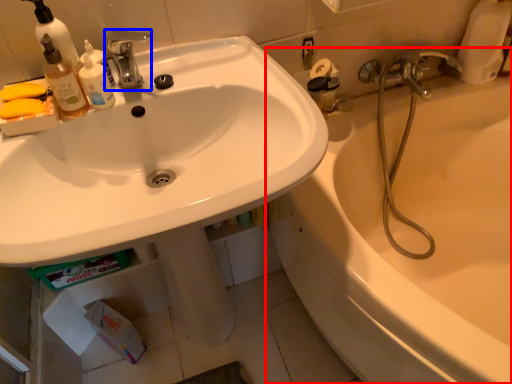
Question: Among these objects, which one is nearest to the camera, bathtub (highlighted by a red box) or tap (highlighted by a blue box)?

Choices:
 (A) bathtub
 (B) tap

Answer: (A)